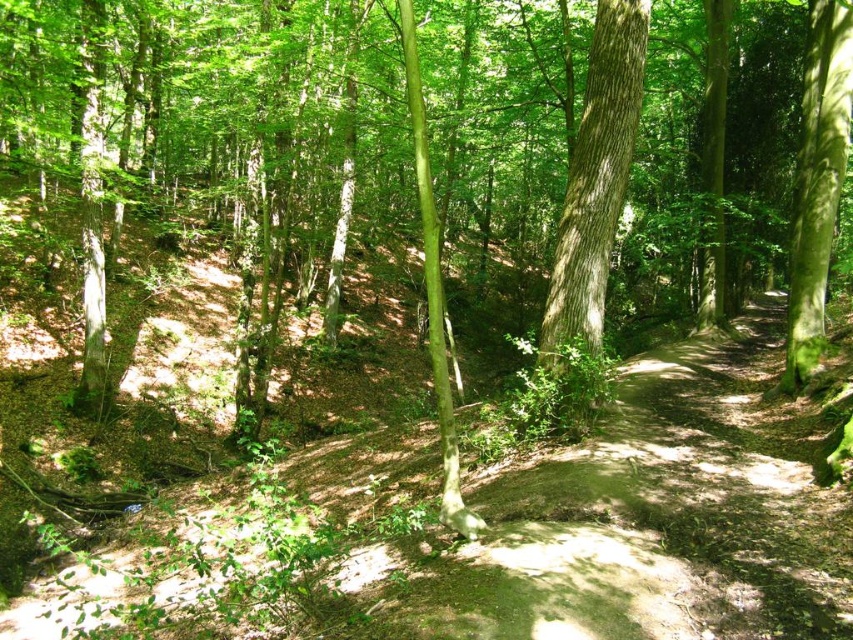
Is smooth bark tree at center below green mossy tree at right?

Yes, smooth bark tree at center is below green mossy tree at right.

Which is more to the left, smooth bark tree at center or green mossy tree at right?

Positioned to the left is smooth bark tree at center.

Between point (631, 19) and point (811, 339), which one is positioned behind?

Point (811, 339)

Where is `smooth bark tree at center`? This screenshot has height=640, width=853. smooth bark tree at center is located at coordinates (595, 179).